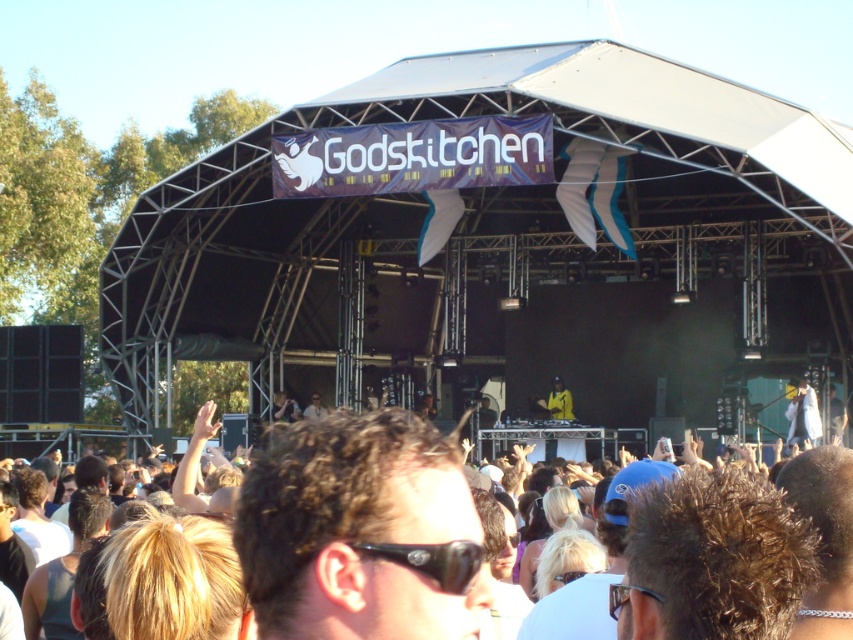
You are a photographer at the music event. You want to capture a photo that highlights both the yellow fabric at center and the light brown hair at center. Which object should you focus on to ensure it takes up more space in the photo?

The light brown hair at center occupies more space than the yellow fabric at center, so focusing on it will ensure it takes up more space in the photo.